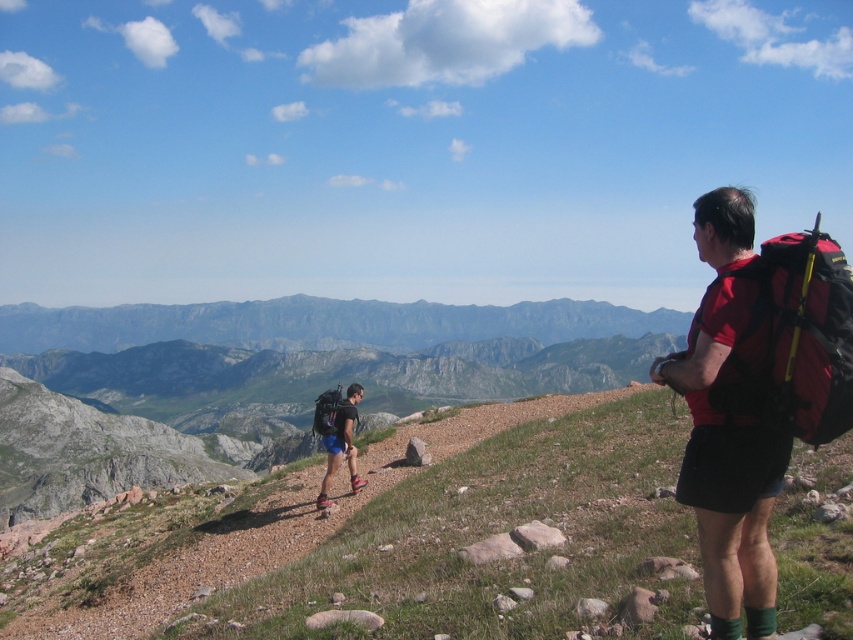
Question: Can you confirm if red fabric backpack at right is positioned to the right of matte black backpack at center?

Choices:
 (A) yes
 (B) no

Answer: (A)

Question: Which point appears farthest from the camera in this image?

Choices:
 (A) (334, 396)
 (B) (323, 488)
 (C) (820, 563)

Answer: (A)

Question: Is green grassy hillside at center positioned before matte black backpack at center?

Choices:
 (A) yes
 (B) no

Answer: (A)

Question: Is green grassy hillside at center below red fabric backpack at right?

Choices:
 (A) yes
 (B) no

Answer: (A)

Question: Which of the following is the farthest from the observer?

Choices:
 (A) (328, 449)
 (B) (264, 564)

Answer: (A)

Question: Which object is positioned closest to the green grassy hillside at center?

Choices:
 (A) red fabric backpack at right
 (B) matte black backpack at center

Answer: (B)